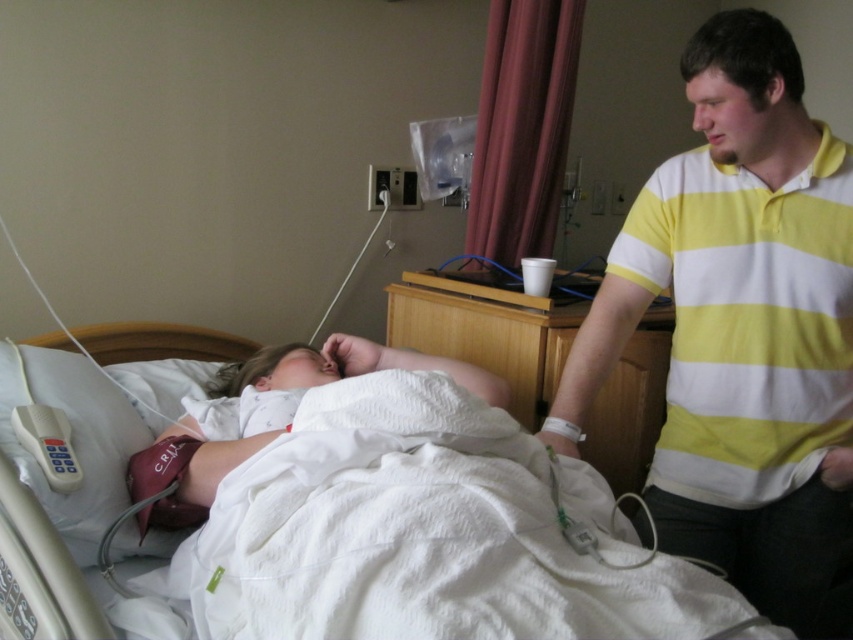
You are a nurse in this hospital room. You need to hand a white plastic remote control at lower left to the white soft baby at center. Can you do this without moving either object?

The white soft baby at center is 12.85 inches away from the white plastic remote control at lower left. Since the distance is more than a typical arm reach, the nurse cannot hand the remote to the baby without moving either object.

You are a nurse in the hospital room. You need to place a medical chart at point A and a syringe at point B. The chart must be placed behind the patient, and the syringe must be placed in front of the patient. Given that point A is at coordinates point (840, 435) and point B is at coordinates point (36, 452), will the placement meet the requirements?

Point (840, 435) is behind point (36, 452). Since the chart at point A is behind the patient and the syringe at point B is in front, the placement meets the requirements.